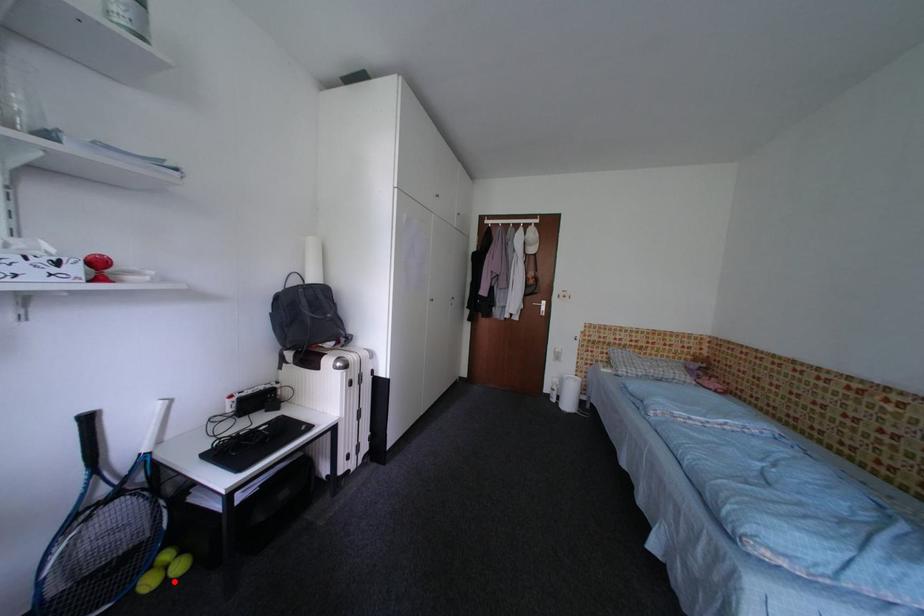
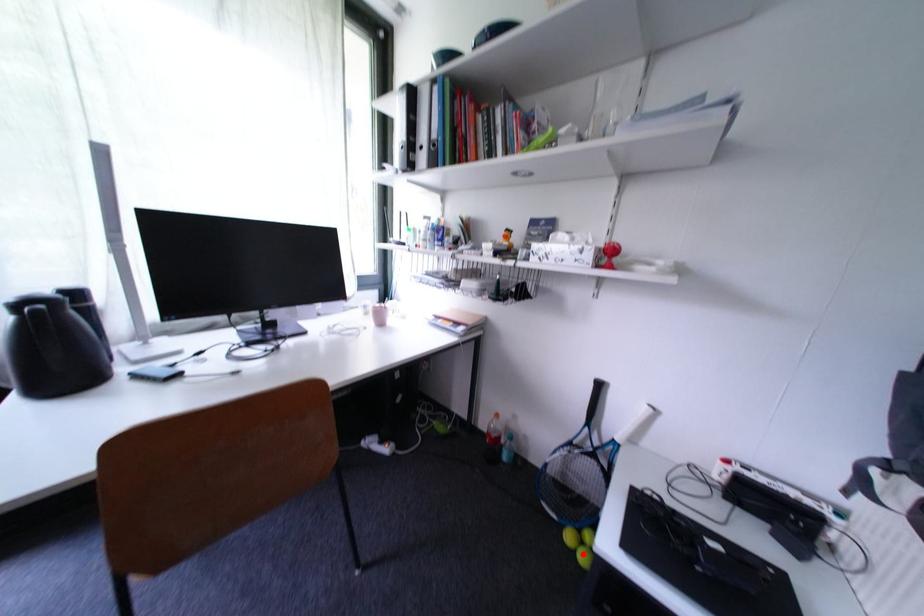
I am providing you with two images of the same scene from different viewpoints. A red point is marked on the first image and another point is marked on the second image. Does the point marked in image1 correspond to the same location as the one in image2?

Yes